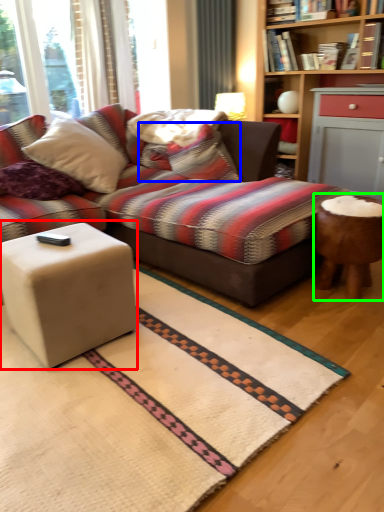
Question: Which is nearer to the coffee table (highlighted by a red box)? pillow (highlighted by a blue box) or table (highlighted by a green box).

Choices:
 (A) pillow
 (B) table

Answer: (B)